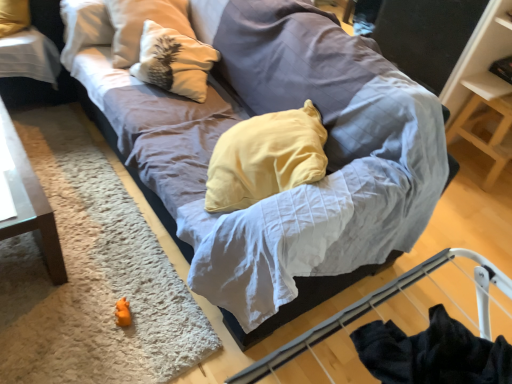
The height and width of the screenshot is (384, 512). In order to click on vacant space underneath white shaggy rug at lower left (from a real-world perspective) in this screenshot , I will do `click(79, 276)`.